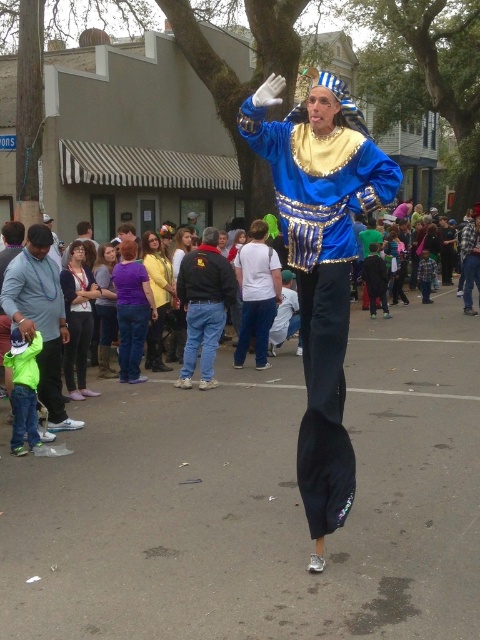
Does purple cotton shirt at center lie in front of denim jacket at lower left?

No.

Which is above, purple cotton shirt at center or denim jacket at lower left?

purple cotton shirt at center is higher up.

Locate an element on the screen. Image resolution: width=480 pixels, height=640 pixels. purple cotton shirt at center is located at coordinates (132, 310).

Does denim jacket at lower left appear under purple fabric shirt at center?

Indeed, denim jacket at lower left is positioned under purple fabric shirt at center.

I want to click on denim jacket at lower left, so click(78, 320).

This screenshot has height=640, width=480. Find the location of `denim jacket at lower left`. denim jacket at lower left is located at coordinates (78, 320).

Find the location of a particular element. denim jacket at lower left is located at coordinates (78, 320).

Who is more forward, (316, 202) or (135, 269)?

Point (316, 202) is in front.

Which is below, blue satin costume at center or purple cotton shirt at center?

blue satin costume at center is below.

At what (x,y) coordinates should I click in order to perform the action: click on blue satin costume at center. Please return your answer as a coordinate pair (x, y). The width and height of the screenshot is (480, 640). Looking at the image, I should click on (321, 262).